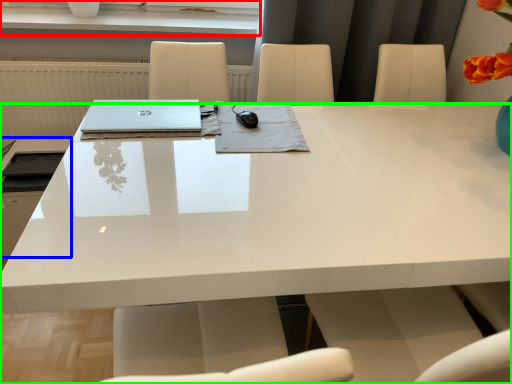
Question: Based on their relative distances, which object is nearer to window sill (highlighted by a red box)? Choose from appliance (highlighted by a blue box) and desk (highlighted by a green box).

Choices:
 (A) appliance
 (B) desk

Answer: (A)